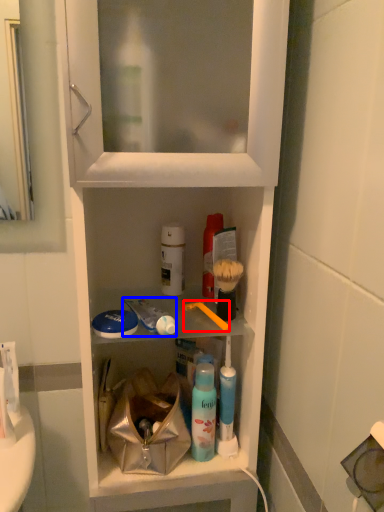
Question: Among these objects, which one is farthest to the camera, toothbrush (highlighted by a red box) or toothpaste (highlighted by a blue box)?

Choices:
 (A) toothbrush
 (B) toothpaste

Answer: (A)